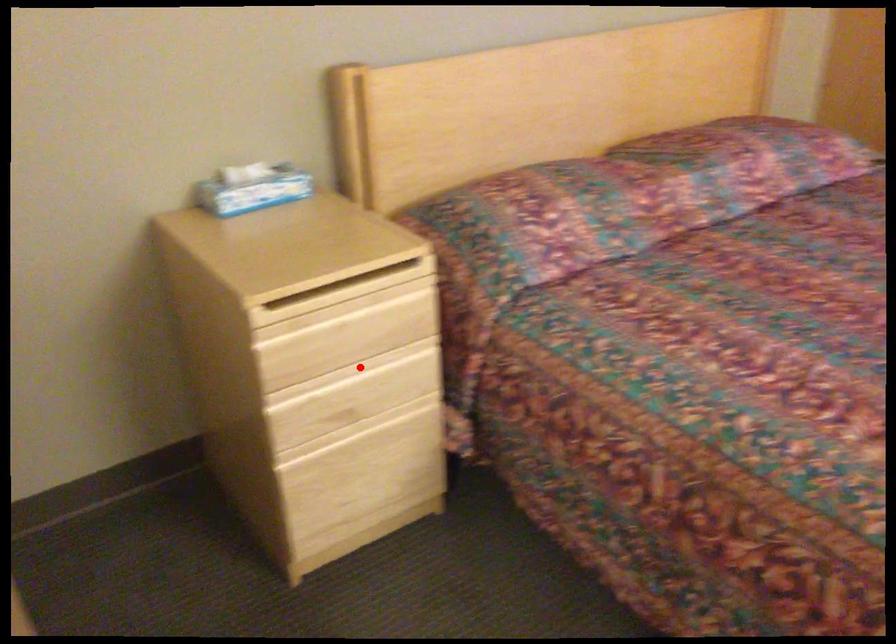
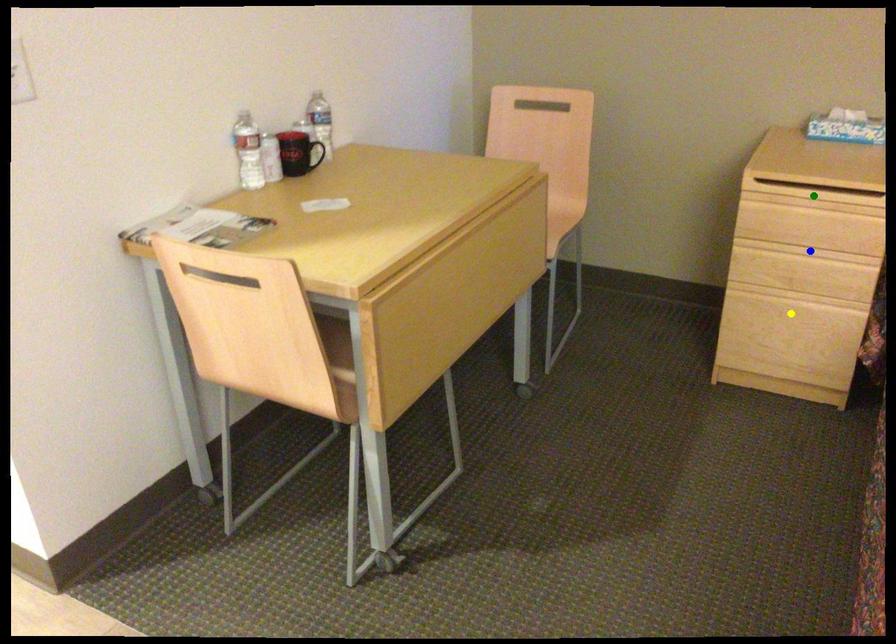
Question: I am providing you with two images of the same scene from different viewpoints. A red point is marked on the first image. You are given multiple points on the second image. Which point in image 2 is actually the same real-world point as the red point in image 1?

Choices:
 (A) blue point
 (B) yellow point
 (C) green point

Answer: (A)